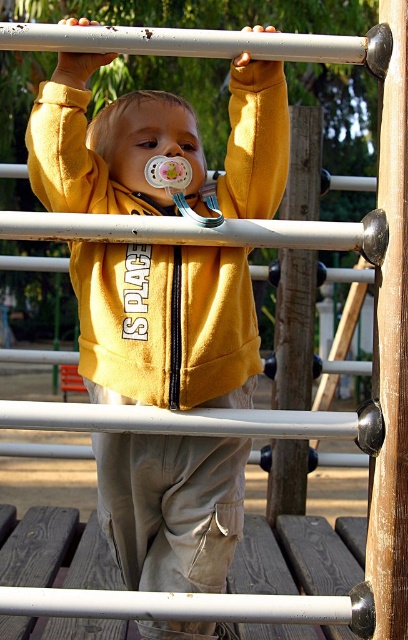
Consider the image. Does yellow fleece sweatshirt at center have a greater height compared to brown wooden pole at center-right?

Yes, yellow fleece sweatshirt at center is taller than brown wooden pole at center-right.

Between yellow fleece sweatshirt at center and brown wooden pole at center-right, which one appears on the left side from the viewer's perspective?

Positioned to the left is yellow fleece sweatshirt at center.

You are a GUI agent. You are given a task and a screenshot of the screen. Output one action in this format:
    pyautogui.click(x=<x>, y=<y>)
    Task: Click on the yellow fleece sweatshirt at center
    The height and width of the screenshot is (640, 408).
    Given the screenshot: What is the action you would take?
    pyautogui.click(x=166, y=324)